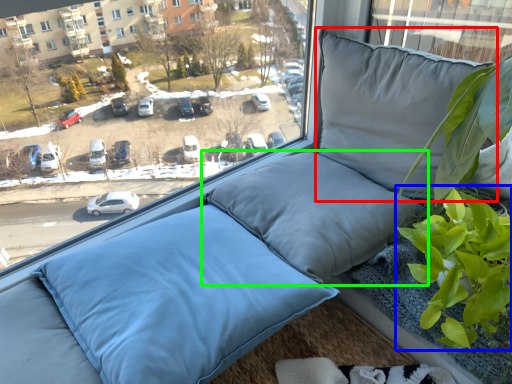
Question: Based on their relative distances, which object is nearer to pillow (highlighted by a red box)? Choose from vegetation (highlighted by a blue box) and pillow (highlighted by a green box).

Choices:
 (A) vegetation
 (B) pillow

Answer: (B)